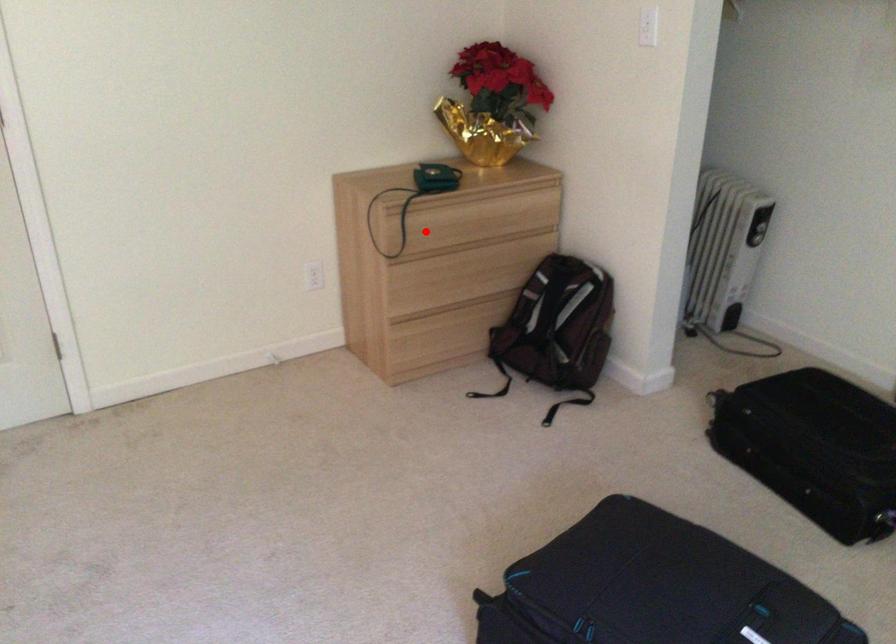
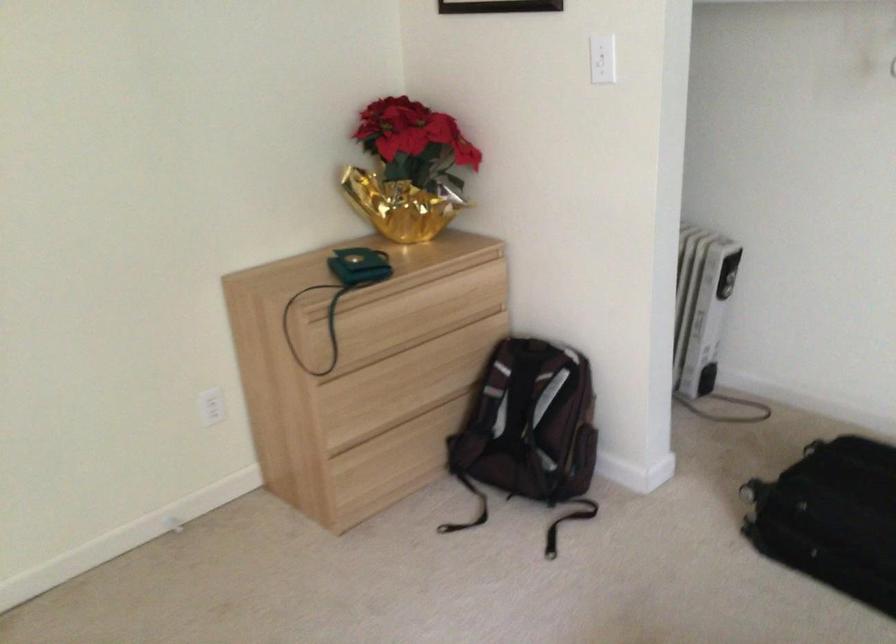
The point at the highlighted location is marked in the first image. Where is the corresponding point in the second image?

(362, 335)